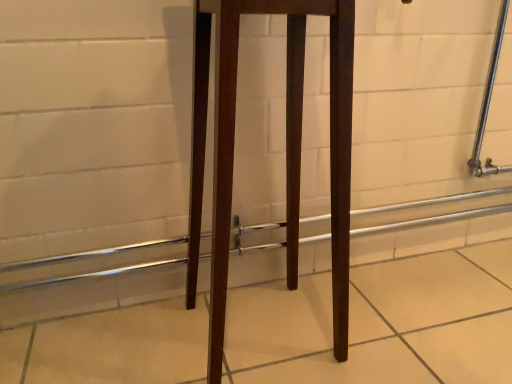
Find the location of a particular element. The height and width of the screenshot is (384, 512). vacant space to the left of dark wood chair at center is located at coordinates (137, 354).